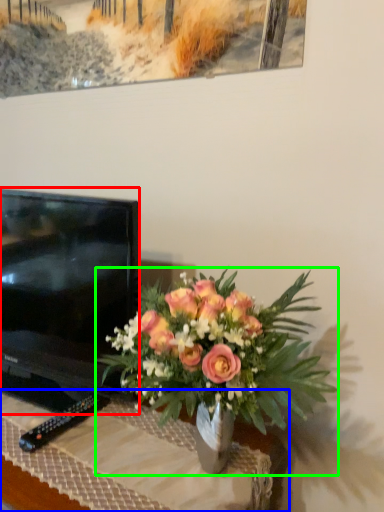
Question: Which is nearer to the television (highlighted by a red box)? desk (highlighted by a blue box) or houseplant (highlighted by a green box).

Choices:
 (A) desk
 (B) houseplant

Answer: (A)